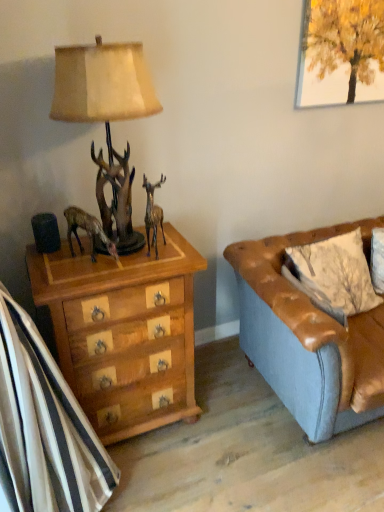
You are a GUI agent. You are given a task and a screenshot of the screen. Output one action in this format:
    pyautogui.click(x=<x>, y=<y>)
    Task: Click on the spots to the right of metallic gold reindeer at center
    The image size is (384, 512).
    Given the screenshot: What is the action you would take?
    [x=175, y=250]